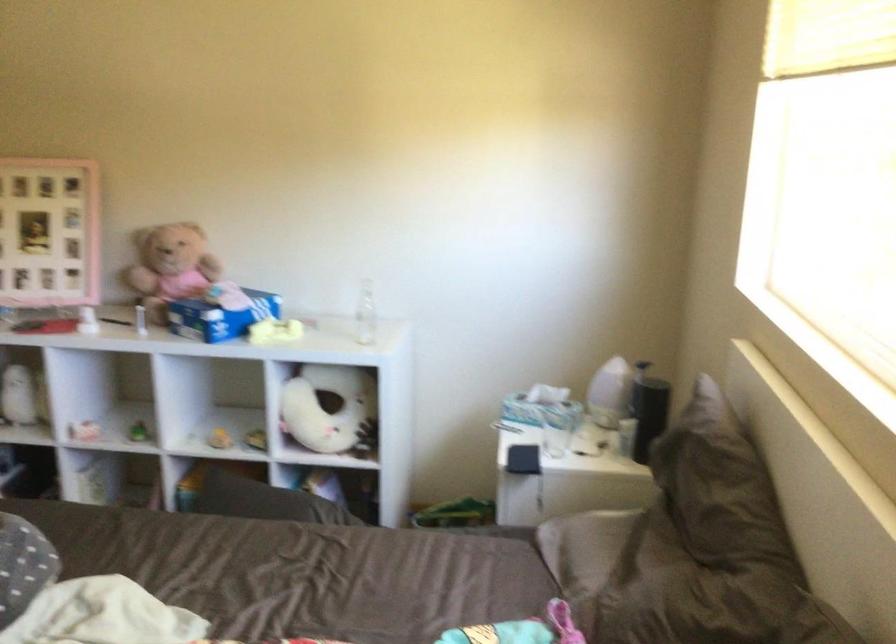
Find the location of `brown teddy bear`. brown teddy bear is located at coordinates (170, 267).